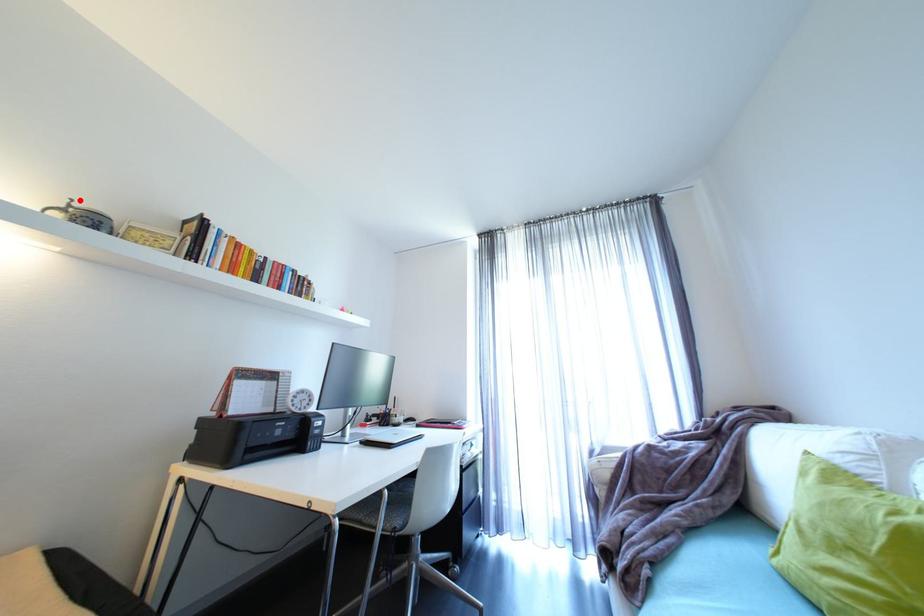
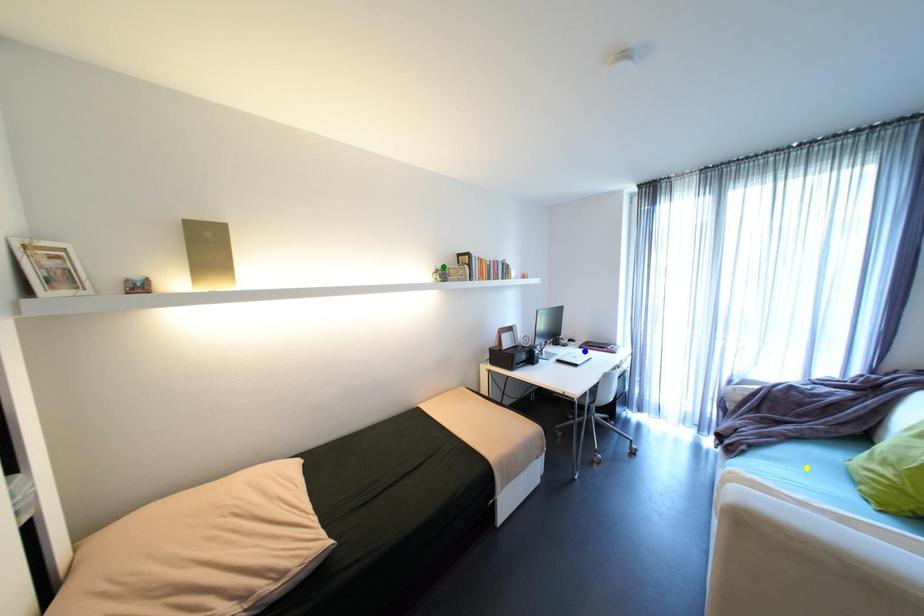
Question: I am providing you with two images of the same scene from different viewpoints. A red point is marked on the first image. You are given multiple points on the second image. Which point in image 2 represents the same 3d spot as the red point in image 1?

Choices:
 (A) yellow point
 (B) green point
 (C) blue point

Answer: (B)